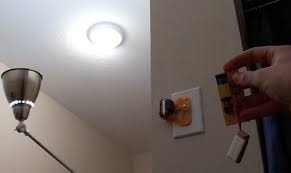
Identify the location of blue curtain. This screenshot has width=291, height=173. (265, 27).